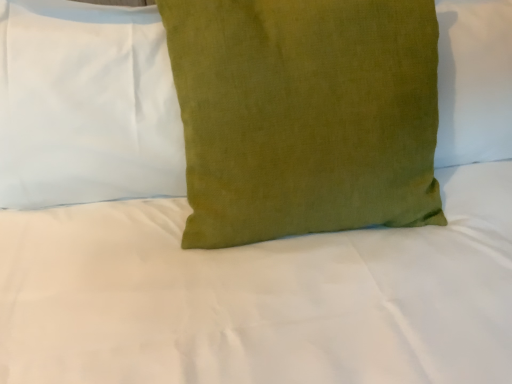
Question: Does green linen pillow at center, the second pillow when ordered from right to left, have a larger size compared to green linen pillow at center, the second pillow viewed from the left?

Choices:
 (A) no
 (B) yes

Answer: (A)

Question: Is green linen pillow at center, acting as the first pillow starting from the left, outside green linen pillow at center, the second pillow viewed from the left?

Choices:
 (A) yes
 (B) no

Answer: (A)

Question: Is green linen pillow at center, the second pillow when ordered from right to left, surrounding green linen pillow at center, the second pillow viewed from the left?

Choices:
 (A) yes
 (B) no

Answer: (B)

Question: Considering the relative sizes of green linen pillow at center, acting as the first pillow starting from the left, and green linen pillow at center, marked as the first pillow in a right-to-left arrangement, in the image provided, is green linen pillow at center, acting as the first pillow starting from the left, wider than green linen pillow at center, marked as the first pillow in a right-to-left arrangement,?

Choices:
 (A) no
 (B) yes

Answer: (A)

Question: Is green linen pillow at center, the second pillow when ordered from right to left, positioned far away from green linen pillow at center, the second pillow viewed from the left?

Choices:
 (A) yes
 (B) no

Answer: (B)

Question: Is green linen pillow at center, acting as the first pillow starting from the left, at the right side of green linen pillow at center, marked as the first pillow in a right-to-left arrangement?

Choices:
 (A) no
 (B) yes

Answer: (A)

Question: Is green linen pillow at center, marked as the first pillow in a right-to-left arrangement, positioned before green linen pillow at center, acting as the first pillow starting from the left?

Choices:
 (A) yes
 (B) no

Answer: (A)

Question: Does green linen pillow at center, the second pillow viewed from the left, have a lesser width compared to green linen pillow at center, acting as the first pillow starting from the left?

Choices:
 (A) yes
 (B) no

Answer: (B)

Question: From the image's perspective, would you say green linen pillow at center, marked as the first pillow in a right-to-left arrangement, is shown under green linen pillow at center, acting as the first pillow starting from the left?

Choices:
 (A) no
 (B) yes

Answer: (B)

Question: From a real-world perspective, is green linen pillow at center, marked as the first pillow in a right-to-left arrangement, positioned over green linen pillow at center, the second pillow when ordered from right to left, based on gravity?

Choices:
 (A) yes
 (B) no

Answer: (B)

Question: Is green linen pillow at center, the second pillow viewed from the left, behind green linen pillow at center, acting as the first pillow starting from the left?

Choices:
 (A) no
 (B) yes

Answer: (A)

Question: Does green linen pillow at center, the second pillow viewed from the left, appear on the right side of green linen pillow at center, the second pillow when ordered from right to left?

Choices:
 (A) no
 (B) yes

Answer: (B)

Question: Is point (419, 26) closer or farther from the camera than point (44, 137)?

Choices:
 (A) closer
 (B) farther

Answer: (A)